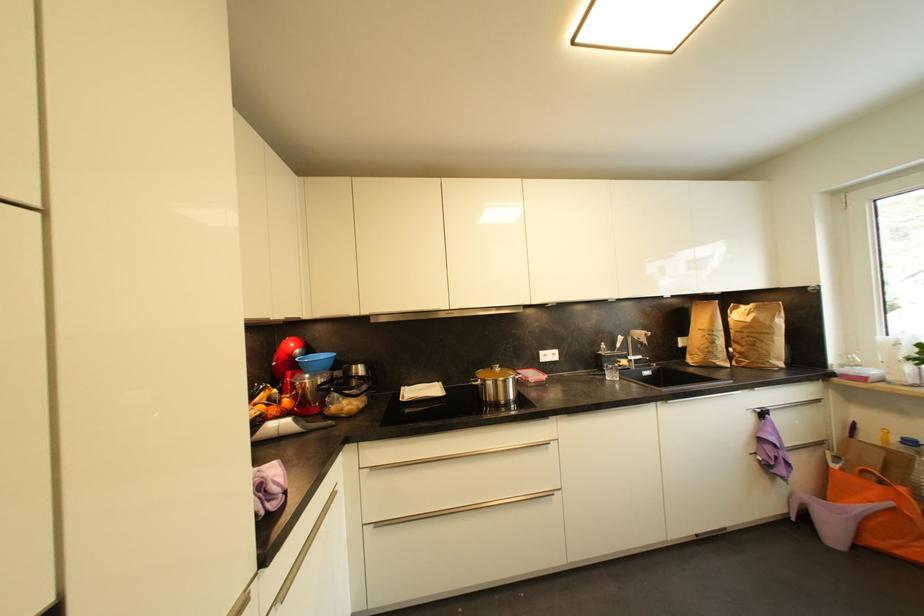
Find the location of a particular element. faucet handle is located at coordinates (638, 346).